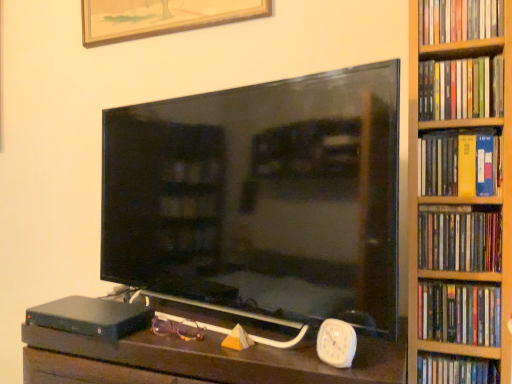
Question: Is purple plastic glasses at center far from white plastic clock at lower right?

Choices:
 (A) yes
 (B) no

Answer: (B)

Question: Is purple plastic glasses at center behind white plastic clock at lower right?

Choices:
 (A) no
 (B) yes

Answer: (B)

Question: Can you confirm if purple plastic glasses at center is positioned to the left of white plastic clock at lower right?

Choices:
 (A) no
 (B) yes

Answer: (B)

Question: Can you confirm if purple plastic glasses at center is shorter than white plastic clock at lower right?

Choices:
 (A) no
 (B) yes

Answer: (B)

Question: Does purple plastic glasses at center have a smaller size compared to white plastic clock at lower right?

Choices:
 (A) no
 (B) yes

Answer: (B)

Question: From a real-world perspective, is purple plastic glasses at center below white plastic clock at lower right?

Choices:
 (A) yes
 (B) no

Answer: (A)

Question: Considering the relative sizes of purple plastic glasses at center and matte black tv at center in the image provided, is purple plastic glasses at center shorter than matte black tv at center?

Choices:
 (A) yes
 (B) no

Answer: (A)

Question: Does purple plastic glasses at center have a smaller size compared to matte black tv at center?

Choices:
 (A) no
 (B) yes

Answer: (B)

Question: Does purple plastic glasses at center appear on the left side of matte black tv at center?

Choices:
 (A) no
 (B) yes

Answer: (B)

Question: Is matte black tv at center at the back of purple plastic glasses at center?

Choices:
 (A) yes
 (B) no

Answer: (A)

Question: From a real-world perspective, is purple plastic glasses at center located beneath matte black tv at center?

Choices:
 (A) yes
 (B) no

Answer: (A)

Question: Is purple plastic glasses at center in contact with matte black tv at center?

Choices:
 (A) no
 (B) yes

Answer: (A)

Question: From the image's perspective, is purple plastic glasses at center located beneath black matte hardcover at lower left?

Choices:
 (A) no
 (B) yes

Answer: (A)